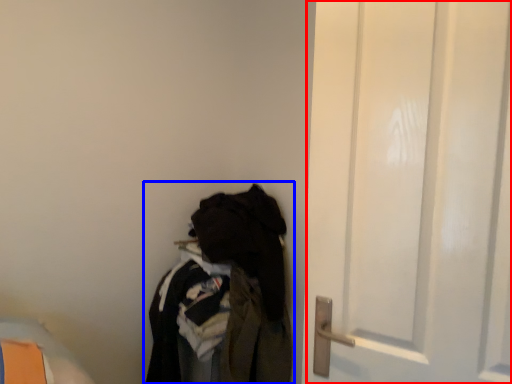
Question: Which point is further to the camera, door (highlighted by a red box) or closet (highlighted by a blue box)?

Choices:
 (A) door
 (B) closet

Answer: (B)